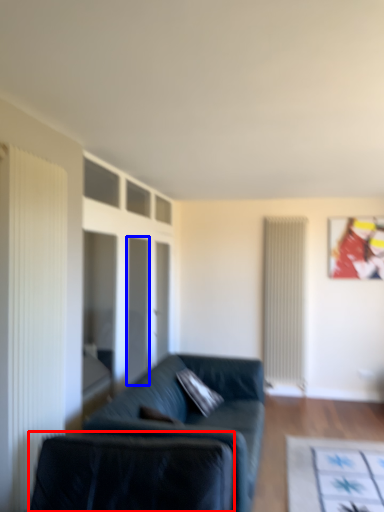
Question: Which object is closer to the camera taking this photo, swivel chair (highlighted by a red box) or glass door (highlighted by a blue box)?

Choices:
 (A) swivel chair
 (B) glass door

Answer: (A)